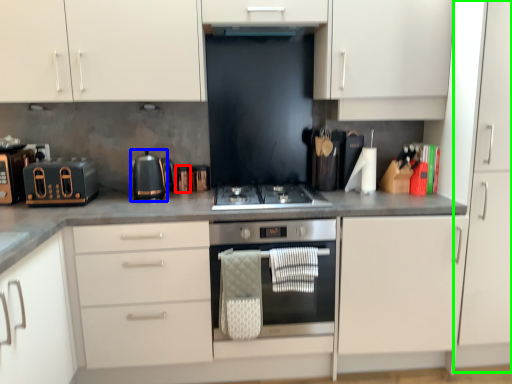
Question: Estimate the real-world distances between objects in this image. Which object is closer to appliance (highlighted by a red box), kitchen appliance (highlighted by a blue box) or cabinet (highlighted by a green box)?

Choices:
 (A) kitchen appliance
 (B) cabinet

Answer: (A)